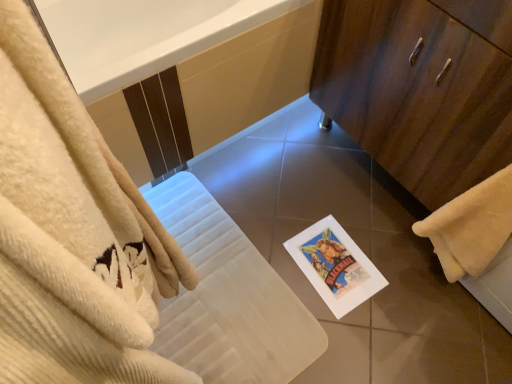
This screenshot has height=384, width=512. I want to click on free spot above white paper postcard at center (from a real-world perspective), so click(x=331, y=262).